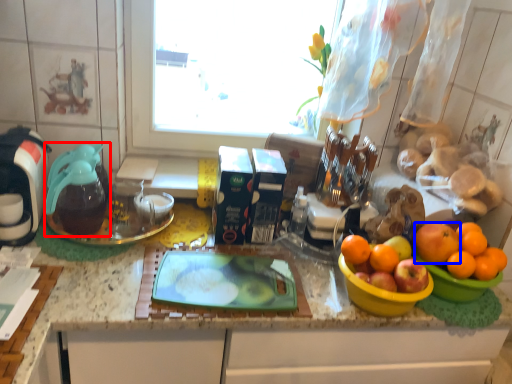
Question: Which object is further to the camera taking this photo, coffeepot (highlighted by a red box) or orange (highlighted by a blue box)?

Choices:
 (A) coffeepot
 (B) orange

Answer: (A)